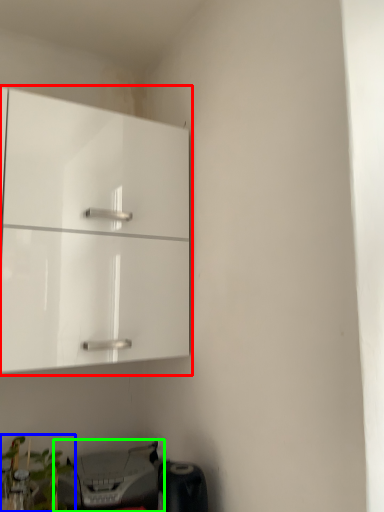
Question: Which object is positioned farthest from cabinetry (highlighted by a red box)? Select from plant (highlighted by a blue box) and printer (highlighted by a green box).

Choices:
 (A) plant
 (B) printer

Answer: (A)